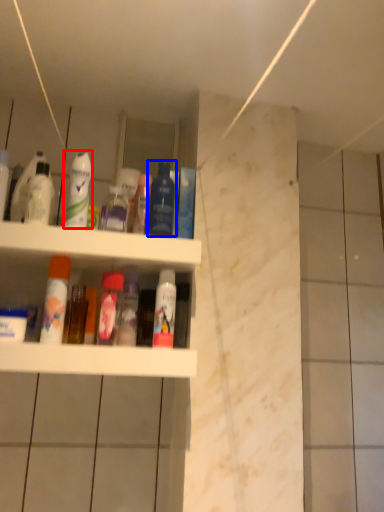
Question: Which point is closer to the camera, cleaning product (highlighted by a red box) or mouthwash (highlighted by a blue box)?

Choices:
 (A) cleaning product
 (B) mouthwash

Answer: (A)